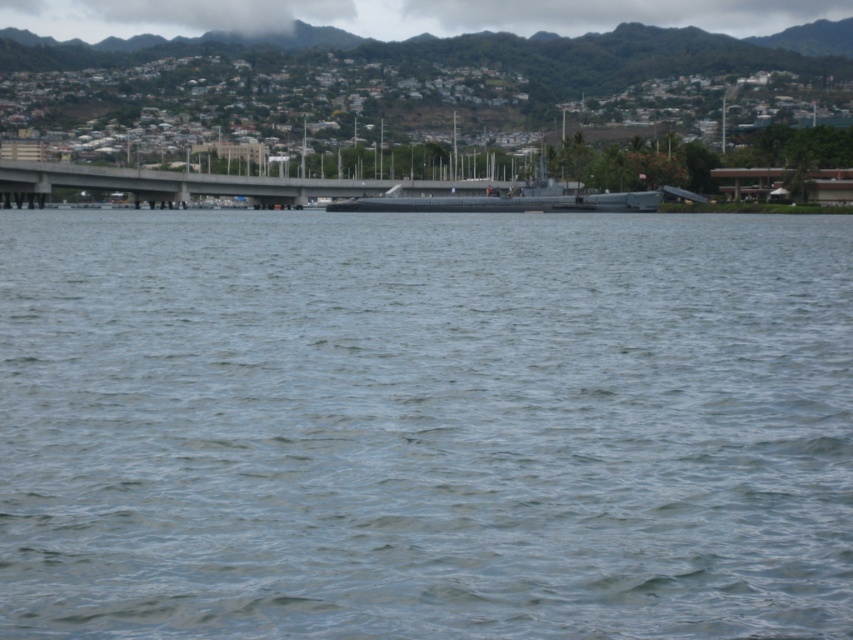
You are a boat captain navigating a vessel that requires a 200 feet clearance between the water and any overhead structures to pass safely. Based on the image, can your boat safely pass under the concrete bridge at center while staying in the gray water at center?

The gray water at center and concrete bridge at center are 227.34 feet apart. Since the required clearance is 200 feet, the boat can safely pass under the concrete bridge at center while staying in the gray water at center because the distance between them is sufficient.

You are a photographer trying to capture the gray water at center and the concrete bridge at center in a single shot. Which object will appear narrower in the photo?

The gray water at center will appear narrower in the photo because it is thinner than the concrete bridge at center.